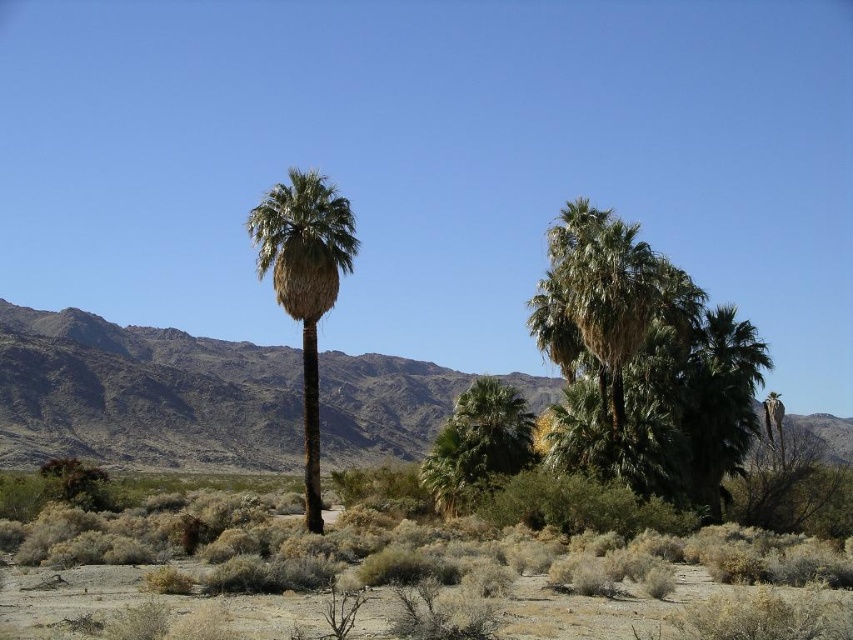
Question: Which point appears closest to the camera in this image?

Choices:
 (A) (314, 300)
 (B) (148, 355)
 (C) (93, 534)

Answer: (C)

Question: Can you confirm if brown rocky mountain at center is thinner than green leafy palm tree at center?

Choices:
 (A) yes
 (B) no

Answer: (B)

Question: Which object appears farthest from the camera in this image?

Choices:
 (A) dry shrubbery at lower center
 (B) green leafy palm tree at center

Answer: (B)

Question: Considering the relative positions of green leafy palm tree at center and green leafy palm at center in the image provided, where is green leafy palm tree at center located with respect to green leafy palm at center?

Choices:
 (A) left
 (B) right

Answer: (B)

Question: Which object is positioned closest to the dry shrubbery at lower center?

Choices:
 (A) green leafy palm tree at center
 (B) green leafy palm at center

Answer: (B)

Question: Is brown rocky mountain at center wider than green leafy palm tree at center?

Choices:
 (A) yes
 (B) no

Answer: (A)